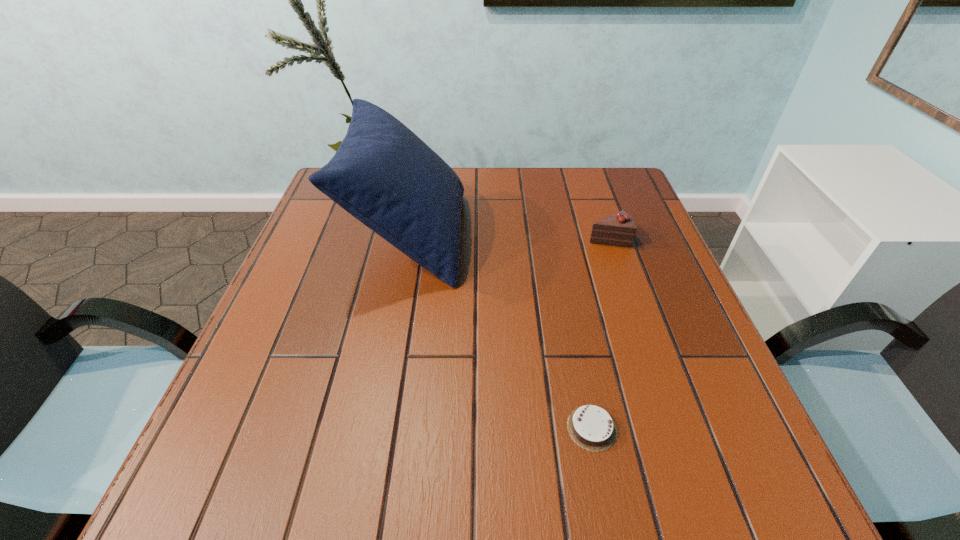
Where is `the second closest object to the shortest object`? Image resolution: width=960 pixels, height=540 pixels. the second closest object to the shortest object is located at coordinates (619, 229).

Image resolution: width=960 pixels, height=540 pixels. Identify the location of free space that satisfies the following two spatial constraints: 1. on the facing side of the left chocolate cake; 2. on the left side of the tallest object. [373, 428].

Where is `vacant space that satisfies the following two spatial constraints: 1. on the facing side of the rightmost object; 2. on the right side of the leftmost object`? The width and height of the screenshot is (960, 540). vacant space that satisfies the following two spatial constraints: 1. on the facing side of the rightmost object; 2. on the right side of the leftmost object is located at coordinates (409, 238).

Identify the location of free location that satisfies the following two spatial constraints: 1. on the back side of the second shortest object; 2. on the facing side of the leftmost object. The height and width of the screenshot is (540, 960). (608, 236).

You are a GUI agent. You are given a task and a screenshot of the screen. Output one action in this format:
    pyautogui.click(x=<x>, y=<y>)
    Task: Click on the vacant space that satisfies the following two spatial constraints: 1. on the facing side of the second object from right to left; 2. on the left side of the leftmost object
    
    Given the screenshot: What is the action you would take?
    pyautogui.click(x=373, y=428)

This screenshot has width=960, height=540. What are the coordinates of `free space that satisfies the following two spatial constraints: 1. on the facing side of the leftmost object; 2. on the back side of the shortest object` in the screenshot? It's located at (373, 428).

This screenshot has width=960, height=540. In order to click on free space that satisfies the following two spatial constraints: 1. on the back side of the farther chocolate cake; 2. on the left side of the second object from right to left in this screenshot , I will do `click(554, 238)`.

This screenshot has width=960, height=540. Identify the location of vacant position in the image that satisfies the following two spatial constraints: 1. on the facing side of the second object from right to left; 2. on the right side of the leftmost object. (373, 428).

This screenshot has height=540, width=960. Find the location of `free location that satisfies the following two spatial constraints: 1. on the facing side of the second object from left to right; 2. on the right side of the leftmost object`. free location that satisfies the following two spatial constraints: 1. on the facing side of the second object from left to right; 2. on the right side of the leftmost object is located at coordinates (373, 428).

The height and width of the screenshot is (540, 960). In order to click on free space that satisfies the following two spatial constraints: 1. on the back side of the nearest object; 2. on the facing side of the tallest object in this screenshot , I will do `click(554, 236)`.